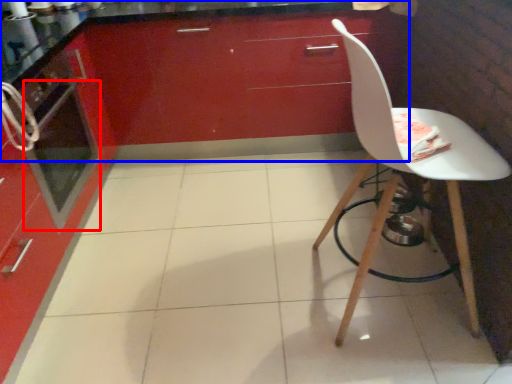
Question: Which object appears farthest to the camera in this image, oven (highlighted by a red box) or cabinetry (highlighted by a blue box)?

Choices:
 (A) oven
 (B) cabinetry

Answer: (B)